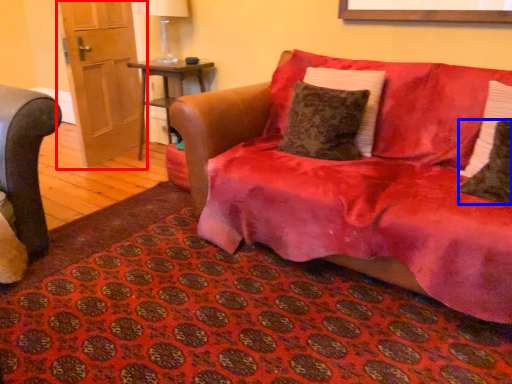
Question: Which point is closer to the camera, door (highlighted by a red box) or pillow (highlighted by a blue box)?

Choices:
 (A) door
 (B) pillow

Answer: (B)